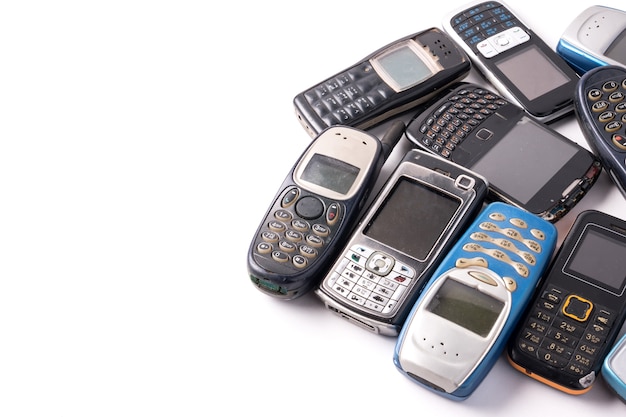
This screenshot has width=626, height=417. I want to click on phones, so pos(316,210), pos(371,232), pos(464,291), pos(572,296), pos(622,352), pos(613,128), pos(535,157), pos(520,64), pos(396,80), pos(580,30).